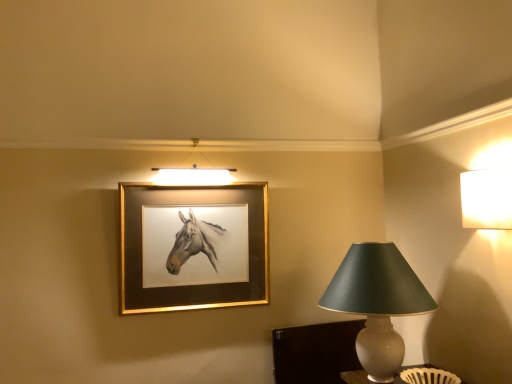
Question: Is white textured lampshade at upper right, the 1th lamp when ordered from top to bottom, at the left side of gold metallic picture frame at upper center?

Choices:
 (A) no
 (B) yes

Answer: (A)

Question: Is white textured lampshade at upper right, which appears as the second lamp when viewed from the left, in front of gold metallic picture frame at upper center?

Choices:
 (A) no
 (B) yes

Answer: (B)

Question: From a real-world perspective, is white textured lampshade at upper right, placed as the second lamp when sorted from bottom to top, below gold metallic picture frame at upper center?

Choices:
 (A) yes
 (B) no

Answer: (B)

Question: Is white textured lampshade at upper right, arranged as the first lamp when viewed from the right, positioned with its back to gold metallic picture frame at upper center?

Choices:
 (A) yes
 (B) no

Answer: (B)

Question: Considering the relative positions of white textured lampshade at upper right, placed as the second lamp when sorted from bottom to top, and gold metallic picture frame at upper center in the image provided, is white textured lampshade at upper right, placed as the second lamp when sorted from bottom to top, behind gold metallic picture frame at upper center?

Choices:
 (A) yes
 (B) no

Answer: (B)

Question: Is gold metallic picture frame at upper center in front of or behind matte gray lampshade at right, acting as the second lamp starting from the top, in the image?

Choices:
 (A) front
 (B) behind

Answer: (B)

Question: Does point (172, 200) appear closer or farther from the camera than point (390, 342)?

Choices:
 (A) closer
 (B) farther

Answer: (B)

Question: From the image's perspective, is gold metallic picture frame at upper center positioned above or below matte gray lampshade at right, placed as the second lamp when sorted from right to left?

Choices:
 (A) below
 (B) above

Answer: (B)

Question: Looking at the image, does gold metallic picture frame at upper center seem bigger or smaller compared to matte gray lampshade at right, the first lamp ordered from the bottom?

Choices:
 (A) big
 (B) small

Answer: (B)

Question: Based on their sizes in the image, would you say matte gray lampshade at right, acting as the second lamp starting from the top, is bigger or smaller than white textured lampshade at upper right, the 1th lamp when ordered from top to bottom?

Choices:
 (A) big
 (B) small

Answer: (A)

Question: Considering the positions of matte gray lampshade at right, acting as the second lamp starting from the top, and white textured lampshade at upper right, arranged as the first lamp when viewed from the right, in the image, is matte gray lampshade at right, acting as the second lamp starting from the top, taller or shorter than white textured lampshade at upper right, arranged as the first lamp when viewed from the right,?

Choices:
 (A) tall
 (B) short

Answer: (A)

Question: From a real-world perspective, is matte gray lampshade at right, the first lamp ordered from the bottom, positioned above or below white textured lampshade at upper right, the 1th lamp when ordered from top to bottom?

Choices:
 (A) below
 (B) above

Answer: (A)

Question: From the image's perspective, is matte gray lampshade at right, which is the 1th lamp in left-to-right order, located above or below white textured lampshade at upper right, which appears as the second lamp when viewed from the left?

Choices:
 (A) above
 (B) below

Answer: (B)

Question: Considering their positions, is matte gray lampshade at right, acting as the second lamp starting from the top, located in front of or behind gold metallic picture frame at upper center?

Choices:
 (A) behind
 (B) front

Answer: (B)

Question: Looking at their shapes, would you say matte gray lampshade at right, which is the 1th lamp in left-to-right order, is wider or thinner than gold metallic picture frame at upper center?

Choices:
 (A) thin
 (B) wide

Answer: (B)